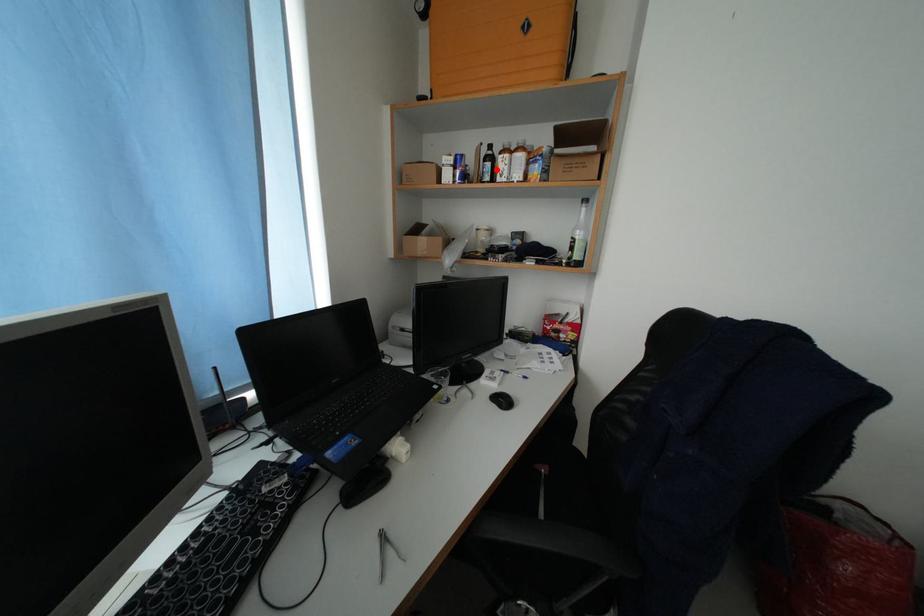
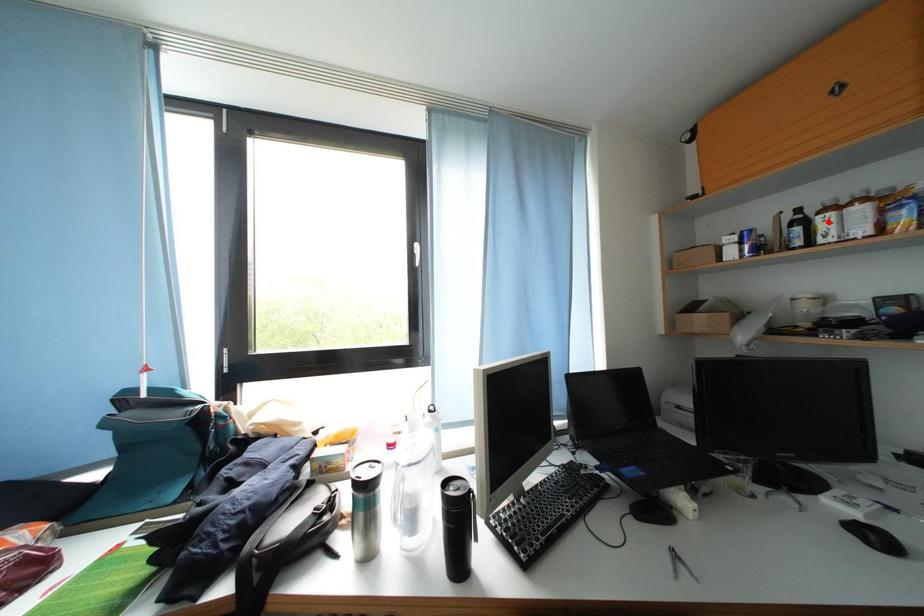
I am providing you with two images of the same scene from different viewpoints. A red point is marked on the first image and another point is marked on the second image. Are the points marked in image1 and image2 representing the same 3D position?

No